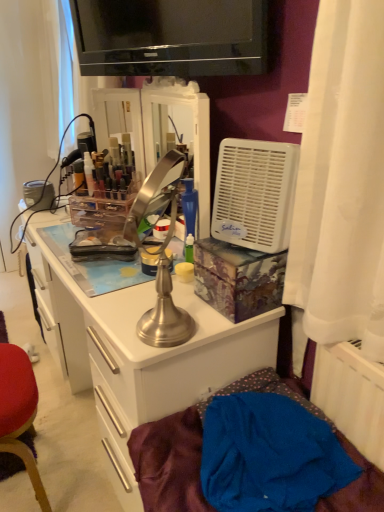
This screenshot has width=384, height=512. Describe the element at coordinates (170, 37) in the screenshot. I see `black glossy television at upper center` at that location.

What is the approximate height of white plastic air conditioner at right?

white plastic air conditioner at right is 9.69 inches tall.

This screenshot has height=512, width=384. What do you see at coordinates (160, 254) in the screenshot?
I see `brushed metal table lamp at center` at bounding box center [160, 254].

Find the location of `blue fabric at lower right`. blue fabric at lower right is located at coordinates (170, 461).

From the image's perspective, is brushed metal table lamp at center above white plastic air conditioner at right?

Incorrect, from the image's perspective, brushed metal table lamp at center is lower than white plastic air conditioner at right.

Image resolution: width=384 pixels, height=512 pixels. I want to click on air conditioning above the brushed metal table lamp at center (from a real-world perspective), so click(255, 194).

Can you confirm if brushed metal table lamp at center is wider than white plastic air conditioner at right?

No, brushed metal table lamp at center is not wider than white plastic air conditioner at right.

Could you tell me if brushed metal table lamp at center is turned towards white plastic air conditioner at right?

No, brushed metal table lamp at center is not turned towards white plastic air conditioner at right.

From the image's perspective, which one is positioned higher, brushed metal desk at center or black glossy television at upper center?

black glossy television at upper center.

At what (x,y) coordinates should I click in order to perform the action: click on cabinetry located behind the black glossy television at upper center. Please return your answer as a coordinate pair (x, y). Image resolution: width=384 pixels, height=512 pixels. Looking at the image, I should click on (139, 353).

Considering the sizes of objects brushed metal desk at center and black glossy television at upper center in the image provided, who is thinner, brushed metal desk at center or black glossy television at upper center?

black glossy television at upper center.

Can you confirm if brushed metal desk at center is shorter than black glossy television at upper center?

No.

Can you confirm if white plastic air conditioner at right is positioned to the right of brushed metal table lamp at center?

Correct, you'll find white plastic air conditioner at right to the right of brushed metal table lamp at center.

Can you confirm if white plastic air conditioner at right is wider than brushed metal table lamp at center?

Correct, the width of white plastic air conditioner at right exceeds that of brushed metal table lamp at center.

Considering the relative positions of white plastic air conditioner at right and brushed metal table lamp at center in the image provided, is white plastic air conditioner at right in front of brushed metal table lamp at center?

No, it is not.

Could you tell me if black glossy television at upper center is turned towards brushed metal desk at center?

No, black glossy television at upper center is not oriented towards brushed metal desk at center.

Find the location of `television on the right of brushed metal desk at center`. television on the right of brushed metal desk at center is located at coordinates (170, 37).

Between black glossy television at upper center and brushed metal desk at center, which one is positioned in front?

black glossy television at upper center is more forward.

Considering the relative positions of black glossy television at upper center and brushed metal desk at center in the image provided, is black glossy television at upper center to the left of brushed metal desk at center from the viewer's perspective?

No.

Identify the location of table lamp that appears below the black glossy television at upper center (from a real-world perspective). The width and height of the screenshot is (384, 512). coord(160,254).

Does point (177, 325) lie behind point (211, 26)?

No, (177, 325) is in front of (211, 26).

Can you confirm if brushed metal table lamp at center is smaller than black glossy television at upper center?

Yes, brushed metal table lamp at center is smaller than black glossy television at upper center.

From the image's perspective, is blue fabric at lower right beneath brushed metal table lamp at center?

Indeed, from the image's perspective, blue fabric at lower right is shown beneath brushed metal table lamp at center.

Is blue fabric at lower right closer to camera compared to brushed metal table lamp at center?

No, it is behind brushed metal table lamp at center.

Based on the photo, which is nearer, (169,510) or (161,197)?

Point (169,510) is positioned closer to the camera compared to point (161,197).

Does brushed metal desk at center appear on the left side of brushed metal table lamp at center?

Yes.

Is brushed metal table lamp at center completely or partially inside brushed metal desk at center?

Definitely not — brushed metal table lamp at center is not inside brushed metal desk at center.

Is brushed metal desk at center directly adjacent to brushed metal table lamp at center?

No, brushed metal desk at center is not touching brushed metal table lamp at center.

This screenshot has height=512, width=384. I want to click on air conditioning located above the brushed metal table lamp at center (from the image's perspective), so click(x=255, y=194).

Locate an element on the screen. This screenshot has height=512, width=384. television positioned vertically above the brushed metal desk at center (from a real-world perspective) is located at coordinates (170, 37).

Looking at the image, which one is located closer to white plastic air conditioner at right, brushed metal table lamp at center or brushed metal desk at center?

brushed metal table lamp at center is closer to white plastic air conditioner at right.

Estimate the real-world distances between objects in this image. Which object is further from brushed metal table lamp at center, brushed metal desk at center or white plastic air conditioner at right?

brushed metal desk at center is further to brushed metal table lamp at center.

Which object lies nearer to the anchor point brushed metal desk at center, black glossy television at upper center or brushed metal table lamp at center?

brushed metal table lamp at center lies closer to brushed metal desk at center than the other object.

Based on their spatial positions, is brushed metal table lamp at center or brushed metal desk at center further from black glossy television at upper center?

Based on the image, brushed metal desk at center appears to be further to black glossy television at upper center.

When comparing their distances from brushed metal desk at center, does black glossy television at upper center or white plastic air conditioner at right seem closer?

white plastic air conditioner at right is closer to brushed metal desk at center.

From the image, which object appears to be nearer to blue fabric at lower right, brushed metal desk at center or black glossy television at upper center?

Based on the image, brushed metal desk at center appears to be nearer to blue fabric at lower right.

Based on their spatial positions, is black glossy television at upper center or blue fabric at lower right further from brushed metal desk at center?

black glossy television at upper center is further to brushed metal desk at center.

Looking at the image, which one is located closer to black glossy television at upper center, brushed metal table lamp at center or white plastic air conditioner at right?

white plastic air conditioner at right is closer to black glossy television at upper center.

Find the location of a particular element. The image size is (384, 512). cabinetry between brushed metal table lamp at center and blue fabric at lower right vertically is located at coordinates (139, 353).

Locate an element on the screen. air conditioning between black glossy television at upper center and brushed metal table lamp at center vertically is located at coordinates (255, 194).

Locate an element on the screen. This screenshot has height=512, width=384. air conditioning between black glossy television at upper center and blue fabric at lower right vertically is located at coordinates (255, 194).

Identify the location of table lamp between white plastic air conditioner at right and brushed metal desk at center in the up-down direction. This screenshot has height=512, width=384. (160, 254).